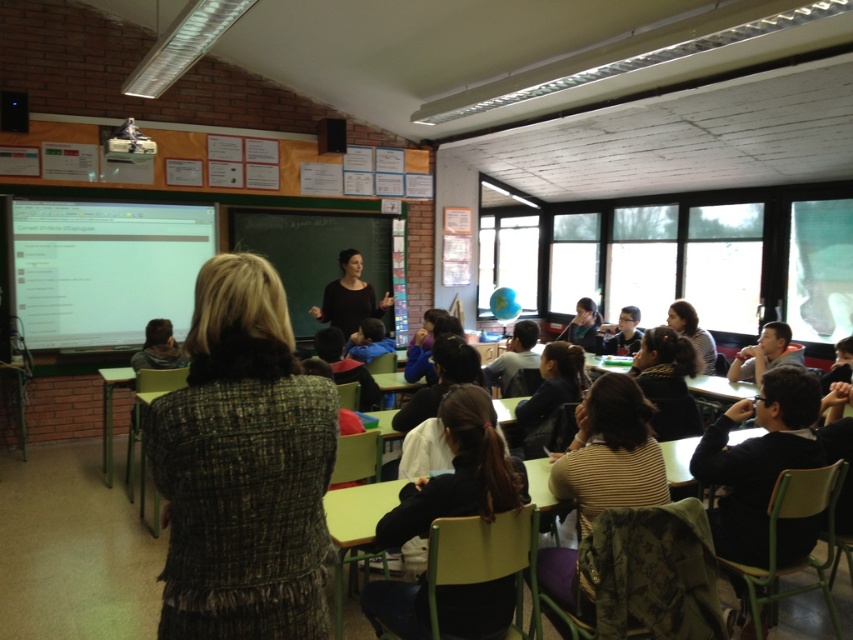
Can you confirm if green chalkboard at center is positioned below black matte/black dress at center?

Incorrect, green chalkboard at center is not positioned below black matte/black dress at center.

Does point (300, 269) come in front of point (357, 259)?

No, it is behind (357, 259).

You are a GUI agent. You are given a task and a screenshot of the screen. Output one action in this format:
    pyautogui.click(x=<x>, y=<y>)
    Task: Click on the green chalkboard at center
    
    Given the screenshot: What is the action you would take?
    pyautogui.click(x=316, y=257)

Locate an element on the screen. The height and width of the screenshot is (640, 853). green chalkboard at center is located at coordinates (316, 257).